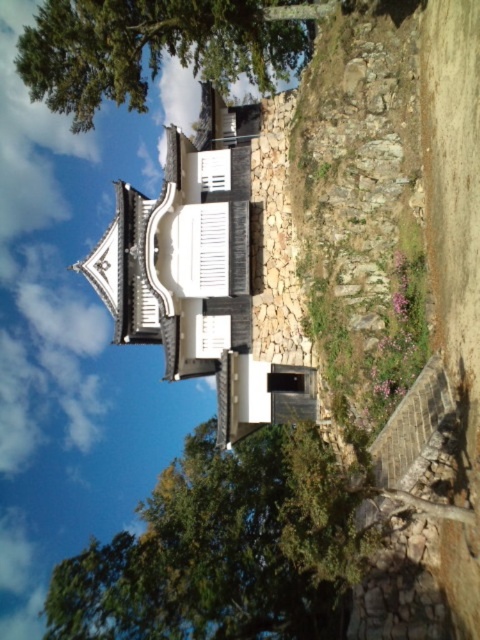
You are an architect visiting this traditional Japanese building. You notice the green leafy tree at upper left and the white matte shutter at center. Which object would cast a longer shadow during midday? Please explain based on their sizes and positions.

The green leafy tree at upper left is larger in size than the white matte shutter at center. Since the tree is larger, it would cast a longer shadow during midday compared to the smaller shutter.

From the picture: You are standing in front of the traditional Japanese building and see two green leafy trees. Which tree is closer to you, the green leafy tree at lower center or the green leafy tree at upper left?

The green leafy tree at lower center is closer to you as it is positioned in front of the green leafy tree at upper left.

You are a visitor standing in front of the traditional Japanese building. You notice a green leafy tree at lower center and a white matte shutter at center. Which object is closer to you?

The green leafy tree at lower center is closer to you because it is in front of the white matte shutter at center.